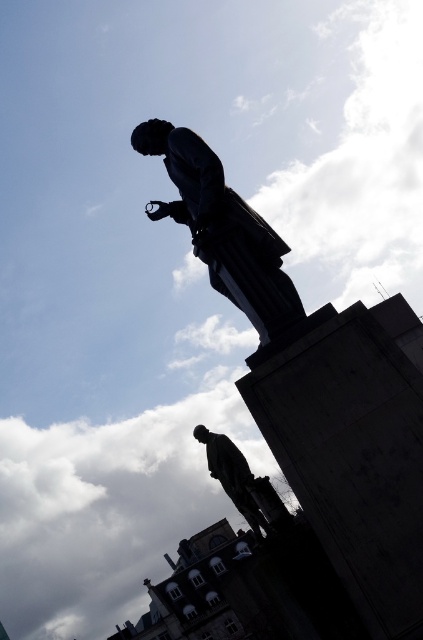
This screenshot has height=640, width=423. Describe the element at coordinates (224, 228) in the screenshot. I see `polished bronze statue at upper center` at that location.

Is polished bronze statue at upper center smaller than polished bronze statue at center?

Actually, polished bronze statue at upper center might be larger than polished bronze statue at center.

What do you see at coordinates (224, 228) in the screenshot? I see `polished bronze statue at upper center` at bounding box center [224, 228].

Image resolution: width=423 pixels, height=640 pixels. I want to click on polished bronze statue at upper center, so click(x=224, y=228).